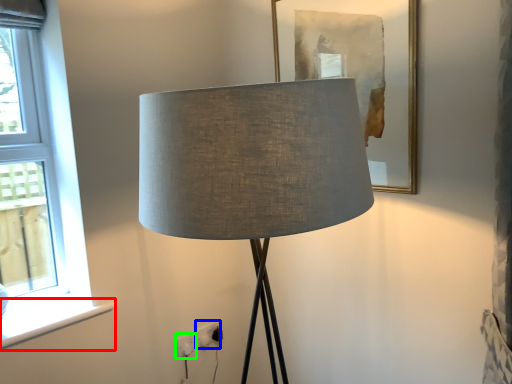
Question: Which is nearer to the window sill (highlighted by a red box)? electric outlet (highlighted by a blue box) or electric outlet (highlighted by a green box).

Choices:
 (A) electric outlet
 (B) electric outlet

Answer: (B)